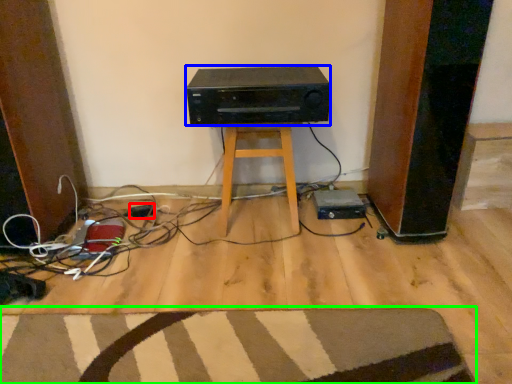
Question: Which object is positioned farthest from plug (highlighted by a red box)? Select from stereo (highlighted by a blue box) and doormat (highlighted by a green box).

Choices:
 (A) stereo
 (B) doormat

Answer: (B)